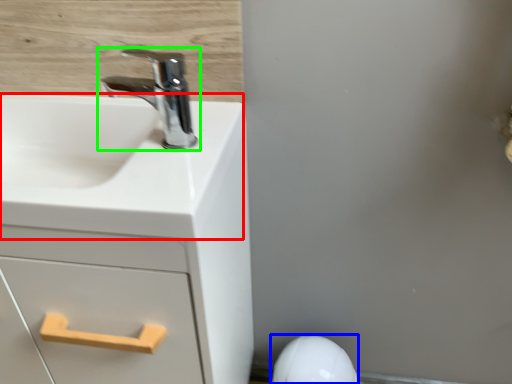
Question: Which object is positioned farthest from counter top (highlighted by a red box)? Select from porcelain (highlighted by a blue box) and tap (highlighted by a green box).

Choices:
 (A) porcelain
 (B) tap

Answer: (A)